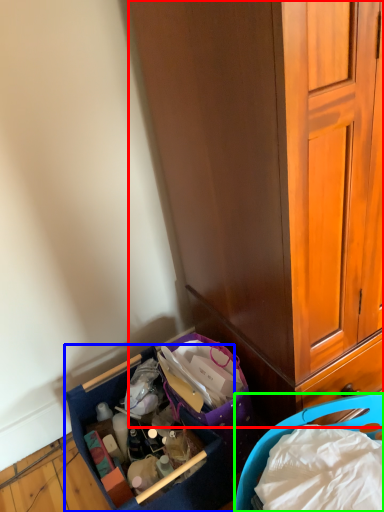
Question: Considering the real-world distances, which object is closest to cabinetry (highlighted by a red box)? picnic basket (highlighted by a blue box) or picnic basket (highlighted by a green box).

Choices:
 (A) picnic basket
 (B) picnic basket

Answer: (B)